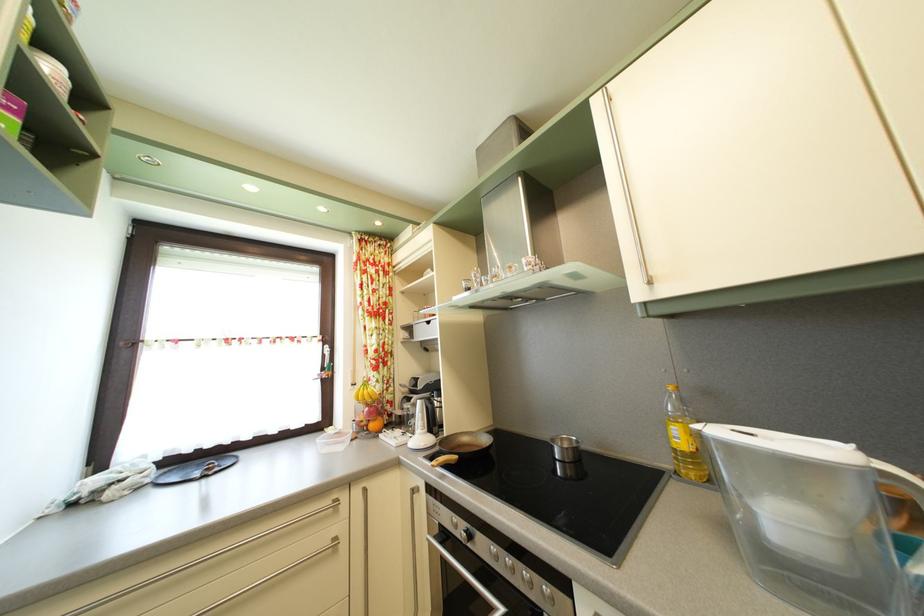
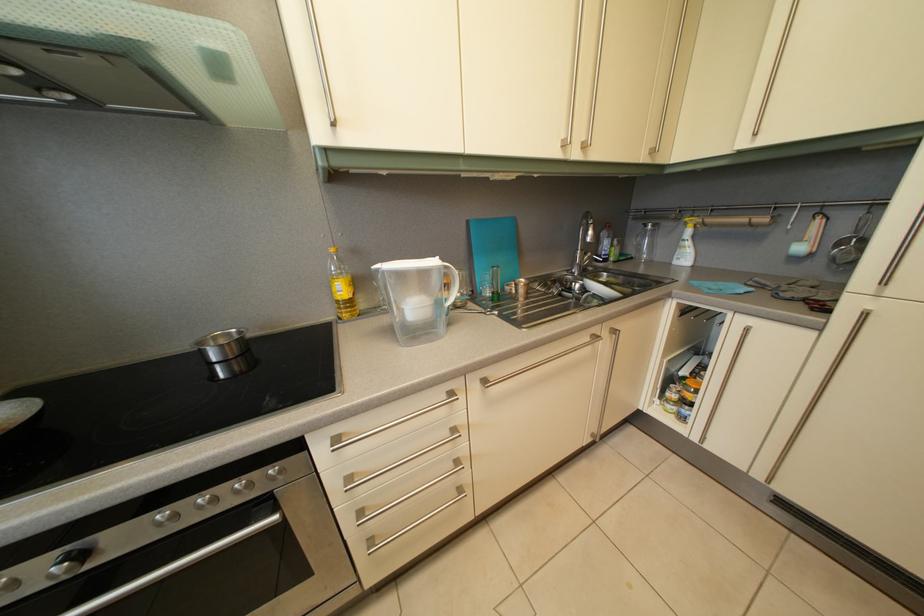
Find the pixel in the second image that matches pixel 517 567 in the first image.

(211, 505)